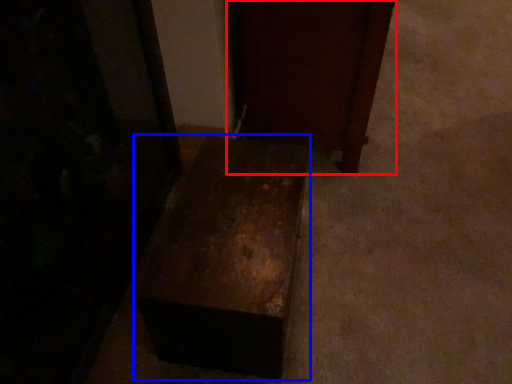
Question: Which of the following is the closest to the observer, furniture (highlighted by a red box) or furniture (highlighted by a blue box)?

Choices:
 (A) furniture
 (B) furniture

Answer: (B)